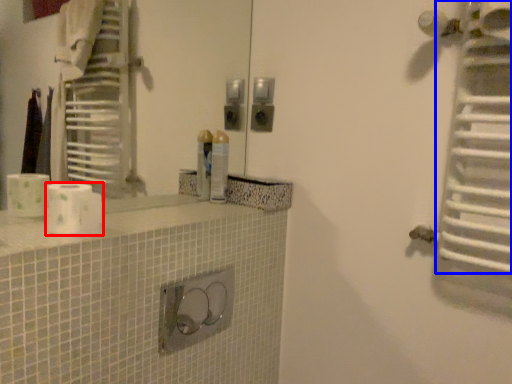
Question: Which of the following is the farthest to the observer, toilet paper (highlighted by a red box) or radiator (highlighted by a blue box)?

Choices:
 (A) toilet paper
 (B) radiator

Answer: (A)